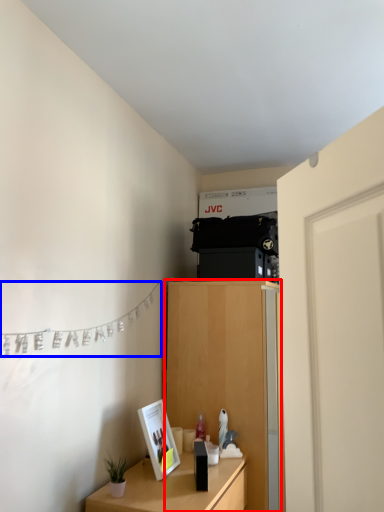
Question: Among these objects, which one is farthest to the camera, cabinetry (highlighted by a red box) or clothesline (highlighted by a blue box)?

Choices:
 (A) cabinetry
 (B) clothesline

Answer: (A)